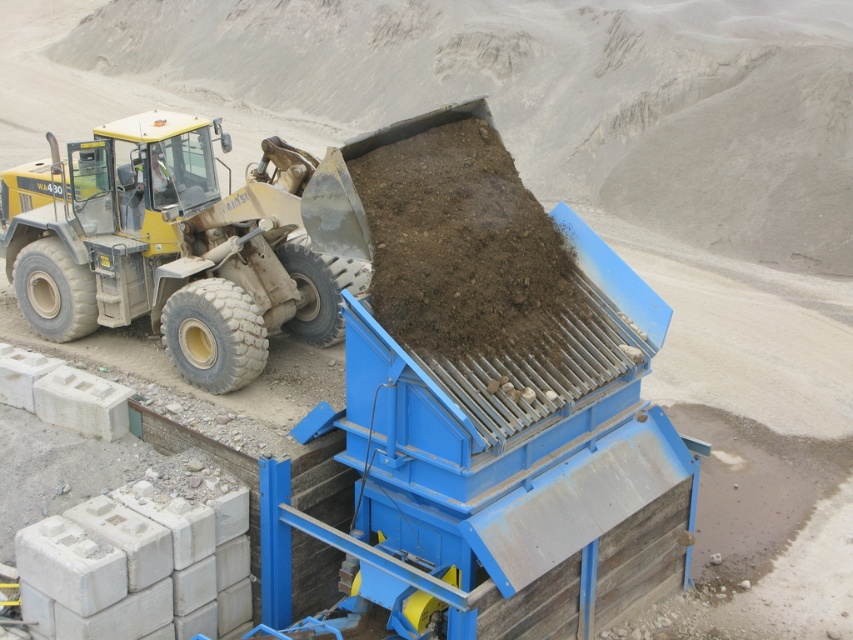
Looking at this image, you are an equipment operator at the construction site. You need to move the dark brown soil at center to a different location. Can you use the yellow rubber tractor at left to do this task?

The yellow rubber tractor at left is smaller than the dark brown soil at center, so it may not have sufficient capacity to move the soil effectively. Consider using a larger vehicle or equipment for this task.

You are operating a yellow rubber tractor at left and need to move to a new location. The coordinates of the target location are at point A, which is at position 0.5, 0.5. Can you reach the target location without crossing the blue conveyor system?

The yellow rubber tractor at left is located at point [173,246]. The target location at [426,320] is further away from the conveyor system. Therefore, the tractor can reach the target location without crossing the blue conveyor system.

You are a safety inspector at the construction site. You need to ensure that the yellow rubber tractor at left is not sinking into the dark brown soil at center. Based on the scene, what should you check first?

The yellow rubber tractor at left is positioned over dark brown soil at center, so you should check the soil stability and the weight distribution of the tractor to prevent sinking.